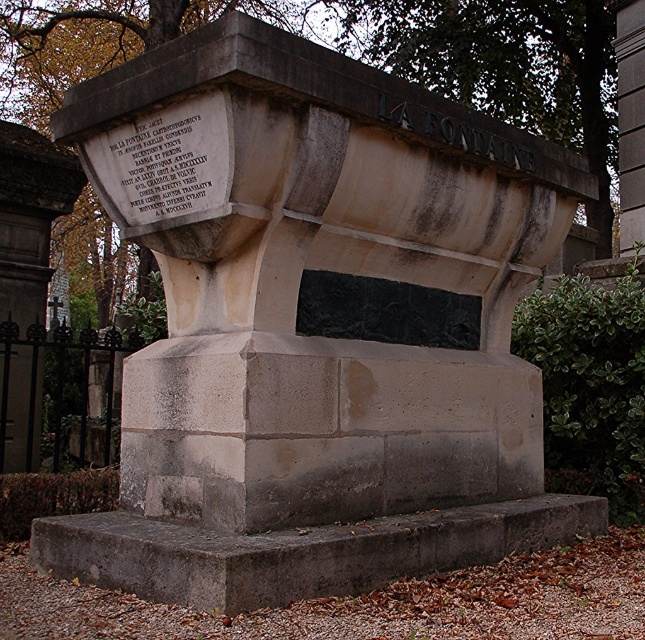
Which of these two, gray stone monument at center or black stone inscription at upper left, stands shorter?

black stone inscription at upper left is shorter.

Who is positioned more to the right, gray stone monument at center or black stone inscription at upper left?

From the viewer's perspective, gray stone monument at center appears more on the right side.

The image size is (645, 640). Describe the element at coordinates (332, 272) in the screenshot. I see `gray stone monument at center` at that location.

Where is `gray stone monument at center`? Image resolution: width=645 pixels, height=640 pixels. gray stone monument at center is located at coordinates (332, 272).

Who is taller, brown stone sign at upper center or black stone inscription at upper left?

With more height is brown stone sign at upper center.

Which is more to the right, brown stone sign at upper center or black stone inscription at upper left?

Positioned to the right is brown stone sign at upper center.

Is point (395, 33) farther from viewer compared to point (104, 161)?

Yes.

Find the location of a particular element. The height and width of the screenshot is (640, 645). brown stone sign at upper center is located at coordinates (504, 67).

Who is lower down, gray stone monument at center or brown stone sign at upper center?

Positioned lower is gray stone monument at center.

Between gray stone monument at center and brown stone sign at upper center, which one is positioned higher?

Positioned higher is brown stone sign at upper center.

Is point (272, 484) positioned after point (412, 17)?

That is False.

What are the coordinates of `gray stone monument at center` in the screenshot? It's located at (332, 272).